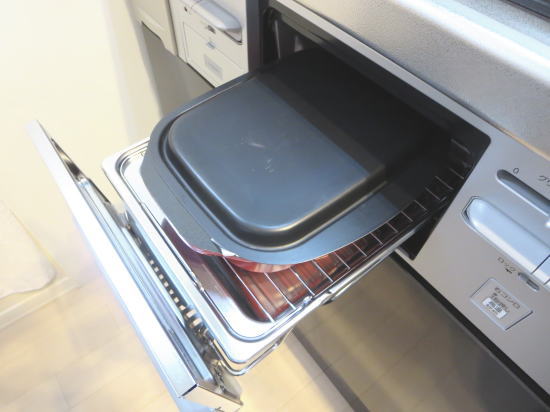
Where is `switch`? This screenshot has width=550, height=412. switch is located at coordinates (497, 307).